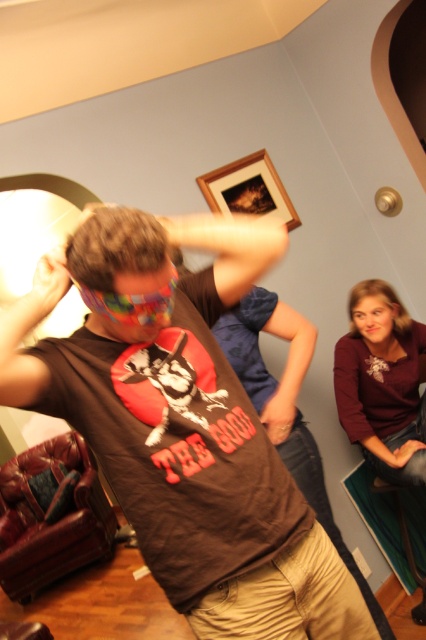
Between point (161, 552) and point (402, 445), which one is positioned in front?

Point (161, 552) is in front.

Which of these two, brown matte t-shirt at center or matte black hand at lower right, stands taller?

Standing taller between the two is brown matte t-shirt at center.

This screenshot has height=640, width=426. In order to click on brown matte t-shirt at center in this screenshot , I will do `click(186, 426)`.

Find the location of a particular element. The height and width of the screenshot is (640, 426). brown matte t-shirt at center is located at coordinates (186, 426).

Between point (45, 264) and point (282, 390), which one is positioned in front?

Point (45, 264) is in front.

Does matte plastic mask at center appear on the left side of matte brown hand at center?

Correct, you'll find matte plastic mask at center to the left of matte brown hand at center.

This screenshot has width=426, height=640. What do you see at coordinates (48, 285) in the screenshot?
I see `matte plastic mask at center` at bounding box center [48, 285].

You are a GUI agent. You are given a task and a screenshot of the screen. Output one action in this format:
    pyautogui.click(x=<x>, y=<y>)
    Task: Click on the matte plastic mask at center
    
    Given the screenshot: What is the action you would take?
    pyautogui.click(x=48, y=285)

Does brown matte t-shirt at center have a lesser width compared to matte plastic mask at center?

In fact, brown matte t-shirt at center might be wider than matte plastic mask at center.

Does brown matte t-shirt at center appear on the right side of matte plastic mask at center?

Indeed, brown matte t-shirt at center is positioned on the right side of matte plastic mask at center.

Image resolution: width=426 pixels, height=640 pixels. Find the location of `brown matte t-shirt at center`. brown matte t-shirt at center is located at coordinates (186, 426).